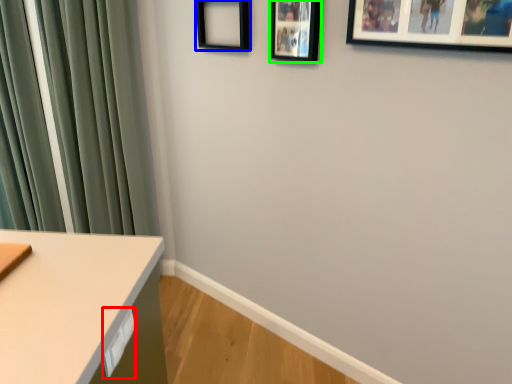
Question: Estimate the real-world distances between objects in this image. Which object is closer to drawer (highlighted by a red box), picture frame (highlighted by a blue box) or picture frame (highlighted by a green box)?

Choices:
 (A) picture frame
 (B) picture frame

Answer: (B)